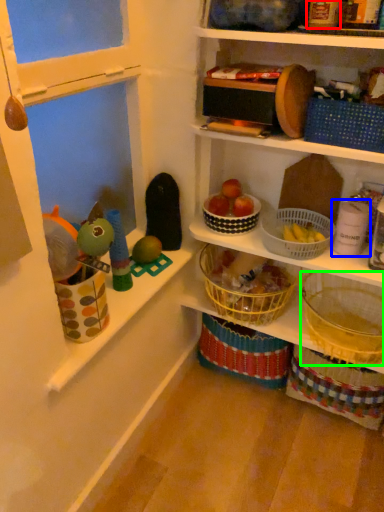
Question: Which is farther away from toy (highlighted by a red box)? toy (highlighted by a blue box) or basket (highlighted by a green box)?

Choices:
 (A) toy
 (B) basket

Answer: (B)